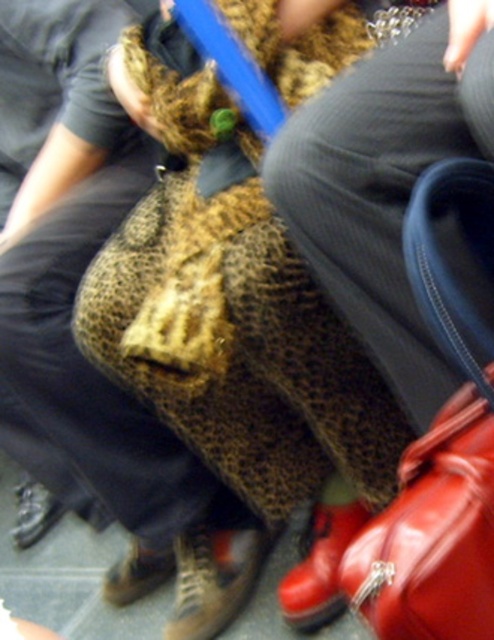
Question: Which object appears farthest from the camera in this image?

Choices:
 (A) shiny red leather shoe at lower right
 (B) brown leather shoe at lower center
 (C) brown leather shoe at lower left
 (D) leather handbag at lower right

Answer: (C)

Question: Is brown leather shoe at lower center bigger than brown leather shoe at lower left?

Choices:
 (A) no
 (B) yes

Answer: (A)

Question: Does leather handbag at lower right appear under leather boot at lower center?

Choices:
 (A) yes
 (B) no

Answer: (B)

Question: Estimate the real-world distances between objects in this image. Which object is farther from the leather handbag at lower right?

Choices:
 (A) brown leather shoe at lower left
 (B) shiny red leather shoe at lower right
 (C) leather boot at lower center

Answer: (A)

Question: Which object appears farthest from the camera in this image?

Choices:
 (A) leather handbag at lower right
 (B) brown leather shoe at lower center

Answer: (B)

Question: In this image, where is leather handbag at lower right located relative to leather boot at lower center?

Choices:
 (A) left
 (B) right

Answer: (B)